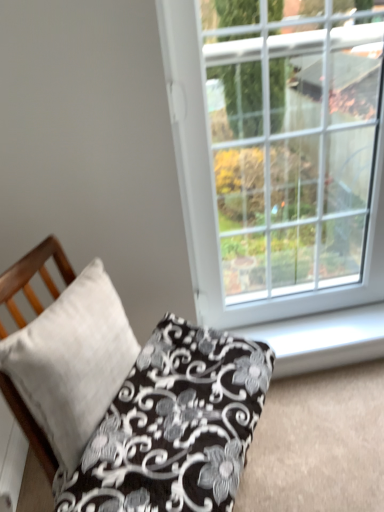
Question: Does point (226, 489) appear closer or farther from the camera than point (91, 429)?

Choices:
 (A) closer
 (B) farther

Answer: (A)

Question: Is satin white pillow at lower left, which is the 2th pillow in left-to-right order, wider or thinner than white matte pillow at left, positioned as the 2th pillow in right-to-left order?

Choices:
 (A) thin
 (B) wide

Answer: (B)

Question: Considering the real-world distances, which object is farthest from the white plastic window sill at lower right?

Choices:
 (A) white matte pillow at left, positioned as the 2th pillow in right-to-left order
 (B) white plastic window at upper right
 (C) satin white pillow at lower left, which is the 2th pillow in left-to-right order

Answer: (A)

Question: Considering the real-world distances, which object is farthest from the white plastic window at upper right?

Choices:
 (A) white matte pillow at left, positioned as the 2th pillow in right-to-left order
 (B) satin white pillow at lower left, which is the 2th pillow in left-to-right order
 (C) white plastic window sill at lower right

Answer: (A)